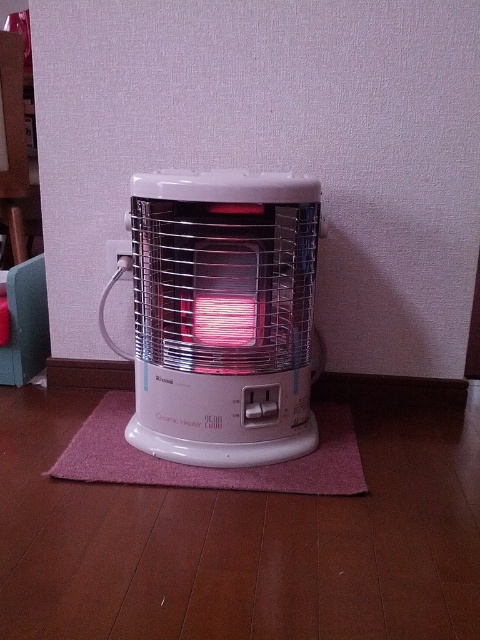
You are standing in front of the ceramic heater and want to reach both points. Which point, point (289,378) or point (124,413), is closer to you?

Point (289,378) is closer to you than point (124,413).

You are standing in a room and see the white glossy ceramic heater at center and the pink fabric mat at center. Which object is positioned more to the left?

The white glossy ceramic heater at center is positioned to the left of the pink fabric mat at center, so it is more to the left.